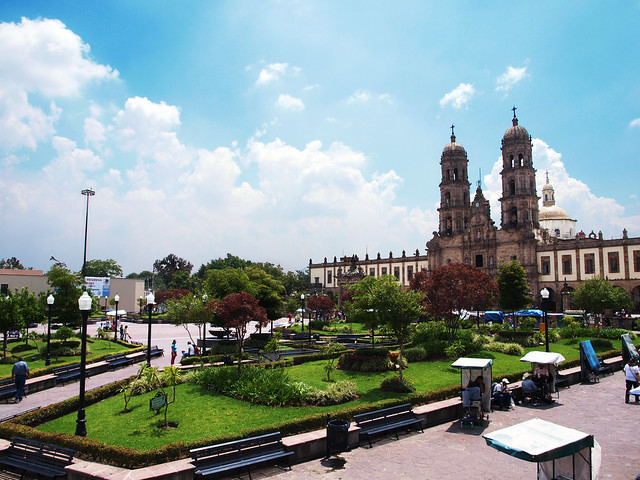
Where is `bench`? bench is located at coordinates (114, 360).